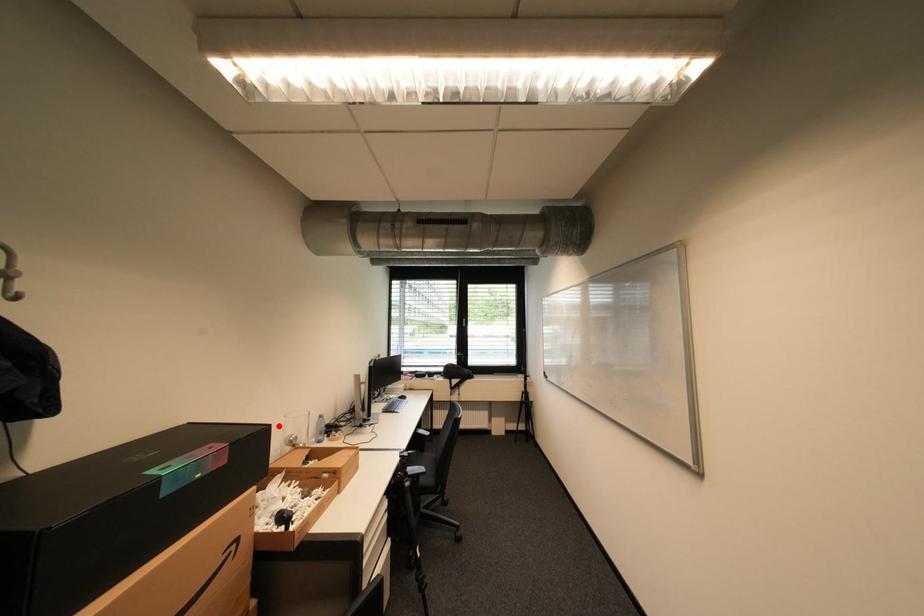
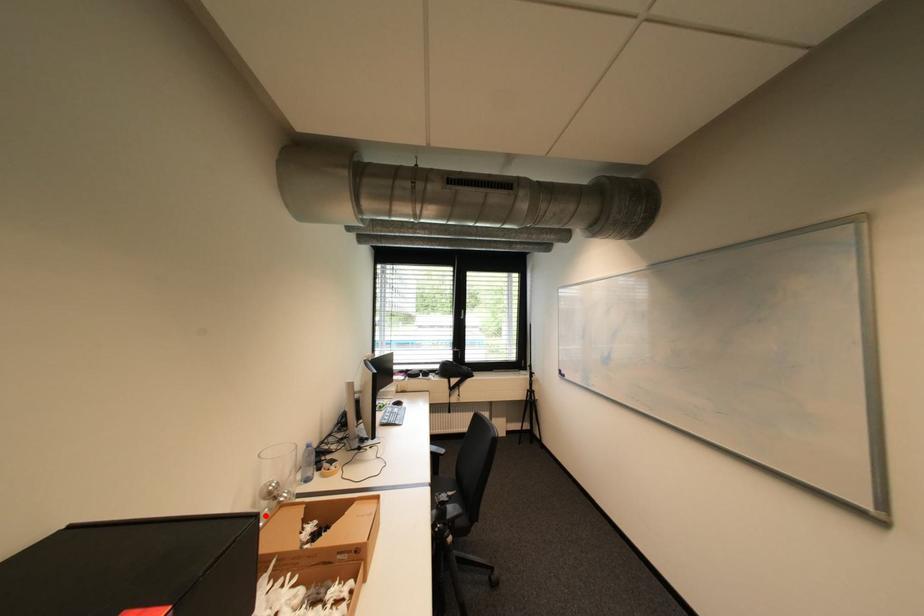
I am providing you with two images of the same scene from different viewpoints. A red point is marked on the first image and another point is marked on the second image. Do the highlighted points in image1 and image2 indicate the same real-world spot?

Yes